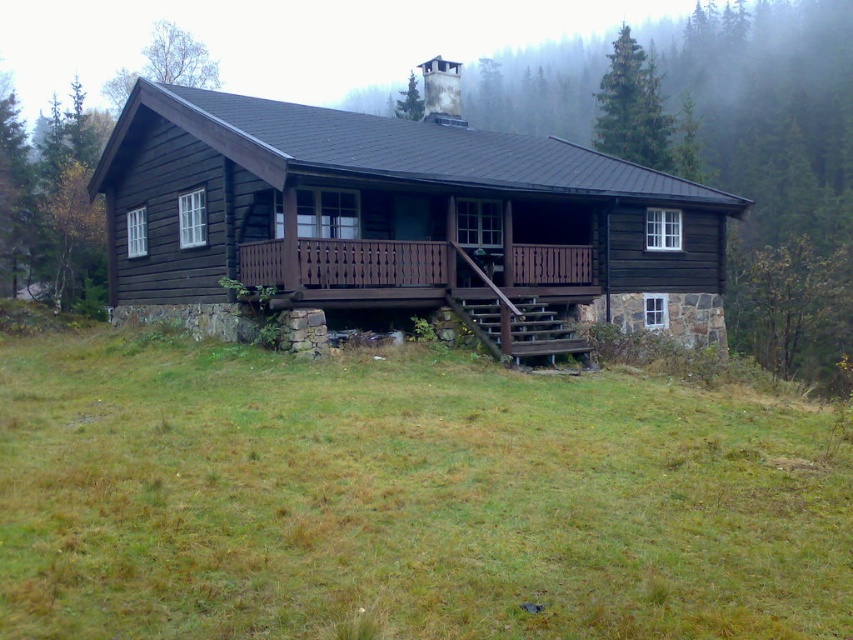
You are standing on the green grass at lower center and want to reach the brown wooden porch at center. Which direction should you move to get there?

You should move upward because the green grass at lower center is shorter than the brown wooden porch at center, so moving upward will lead you to the higher elevation of the porch.

You are standing in front of the cabin and want to step onto the brown wooden porch at center. Which direction should you move relative to the green grass at lower center?

The green grass at lower center is closer to you than the brown wooden porch at center. To step onto the brown wooden porch at center, you should move towards it away from the green grass at lower center.